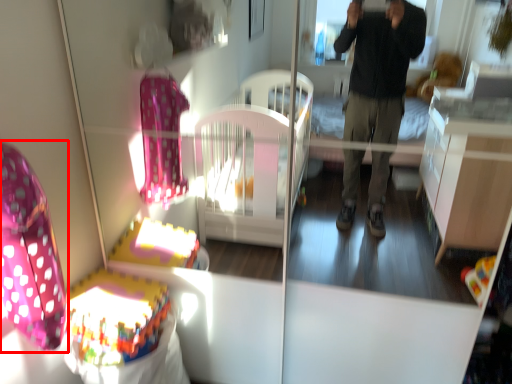
Question: In this image, where is swivel chair (annotated by the red box) located relative to baby carriage?

Choices:
 (A) left
 (B) right

Answer: (A)